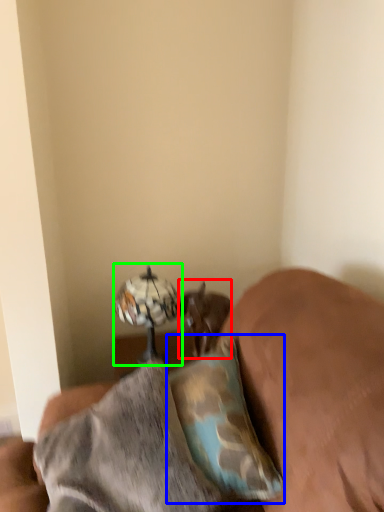
Question: Which object is the closest to the animal (highlighted by a red box)? Choose among these: pillow (highlighted by a blue box) or table lamp (highlighted by a green box).

Choices:
 (A) pillow
 (B) table lamp

Answer: (B)